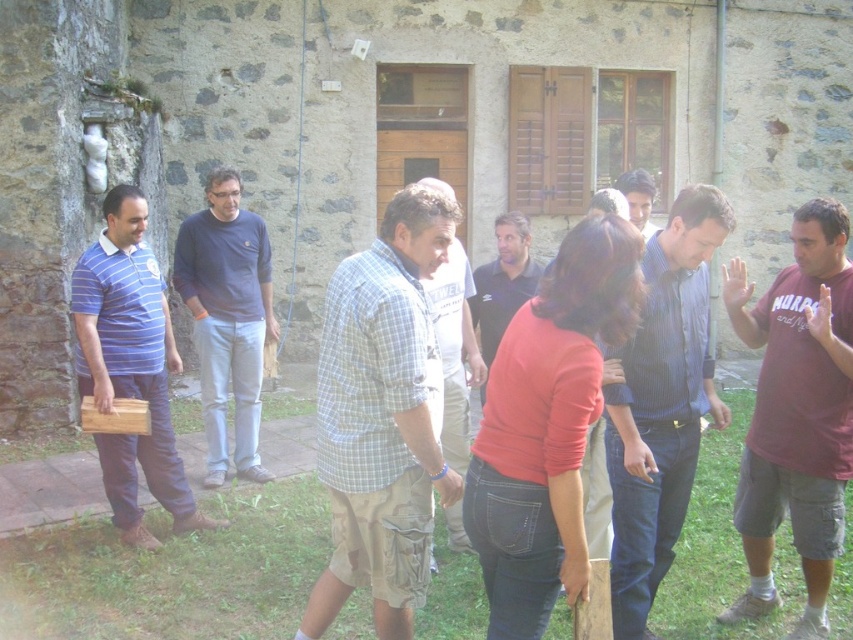
Question: Among these points, which one is nearest to the camera?

Choices:
 (A) (653, 193)
 (B) (415, 296)

Answer: (B)

Question: Does plaid cotton shirt at center have a greater width compared to smooth brown shirt at center?

Choices:
 (A) no
 (B) yes

Answer: (B)

Question: Considering the relative positions of plaid cotton shirt at center and maroon cotton shirt at right in the image provided, where is plaid cotton shirt at center located with respect to maroon cotton shirt at right?

Choices:
 (A) below
 (B) above

Answer: (B)

Question: Does blue striped shirt at center appear under checkered fabric shirt at center?

Choices:
 (A) yes
 (B) no

Answer: (A)

Question: Which is nearer to the plaid cotton shirt at center?

Choices:
 (A) dark blue cotton shirt at center
 (B) blue striped shirt at center
 (C) smooth brown shirt at center

Answer: (B)

Question: Which point is closer to the camera taking this photo?

Choices:
 (A) (778, 284)
 (B) (641, 195)
 (C) (160, 426)

Answer: (A)